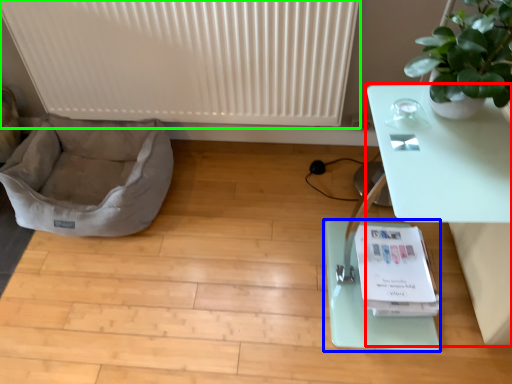
Question: Which is farther away from table (highlighted by a red box)? yoga mat (highlighted by a blue box) or radiator (highlighted by a green box)?

Choices:
 (A) yoga mat
 (B) radiator

Answer: (B)